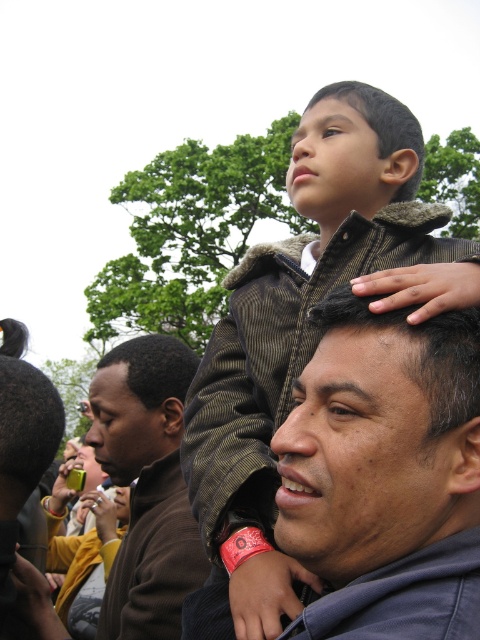
Can you confirm if dark brown hair at center is positioned to the right of brown fleece jacket at left?

Indeed, dark brown hair at center is positioned on the right side of brown fleece jacket at left.

Does dark brown hair at center appear over brown fleece jacket at left?

Yes.

What are the coordinates of `dark brown hair at center` in the screenshot? It's located at (380, 440).

Where is `dark brown hair at center`? The image size is (480, 640). dark brown hair at center is located at coordinates (380, 440).

Is point (339, 140) farther from viewer compared to point (100, 460)?

No, it is not.

Who is lower down, brown fuzzy jacket at upper center or brown woolen head at center?

brown woolen head at center is below.

Does point (362, 173) come closer to viewer compared to point (92, 401)?

Yes, it is in front of point (92, 401).

Where is `brown fuzzy jacket at upper center`? Image resolution: width=480 pixels, height=640 pixels. brown fuzzy jacket at upper center is located at coordinates (352, 154).

Which is more to the right, brown corduroy jacket at upper center or brown woolen head at center?

brown corduroy jacket at upper center is more to the right.

Does brown corduroy jacket at upper center lie in front of brown woolen head at center?

Yes, it is in front of brown woolen head at center.

Between point (264, 266) and point (154, 449), which one is positioned behind?

Positioned behind is point (154, 449).

Where is `brown corduroy jacket at upper center`? brown corduroy jacket at upper center is located at coordinates (302, 326).